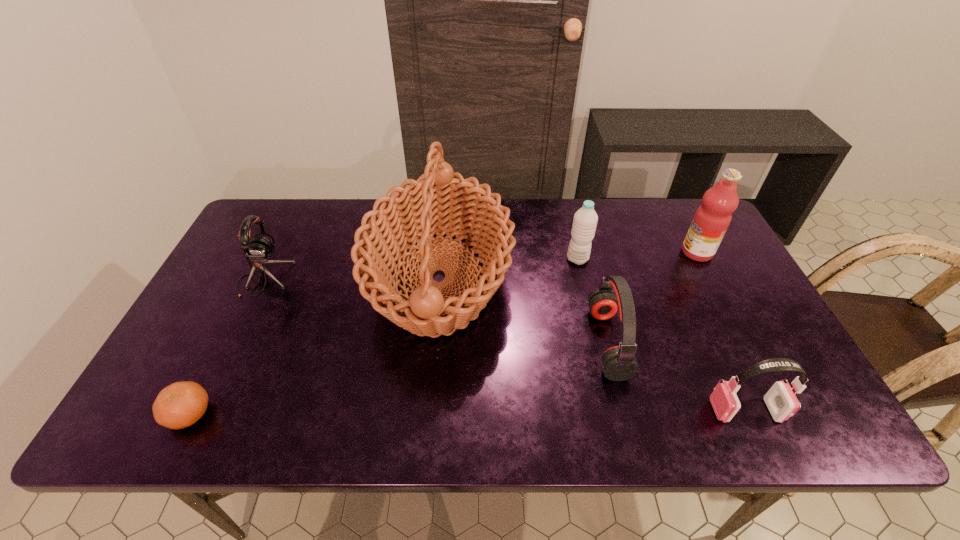
Where is `free space located on the label of the sixth shortest object`? The width and height of the screenshot is (960, 540). free space located on the label of the sixth shortest object is located at coordinates (599, 252).

Identify the location of vacant space situated on the label of the sixth shortest object. (622, 252).

Find the location of a particular element. The width and height of the screenshot is (960, 540). vacant space located 0.230m on the right of the water bottle is located at coordinates (666, 259).

Locate an element on the screen. The width and height of the screenshot is (960, 540). vacant space located 0.220m on the back of the leftmost earphone is located at coordinates (295, 216).

Find the location of a particular element. free location located 0.230m on the ear cups of the second earphone from left to right is located at coordinates (499, 342).

Locate an element on the screen. The height and width of the screenshot is (540, 960). free location located on the ear cups of the second earphone from left to right is located at coordinates (544, 342).

This screenshot has width=960, height=540. What are the coordinates of `vacant point located 0.260m on the ear cups of the second earphone from left to right` in the screenshot? It's located at (488, 342).

The image size is (960, 540). Identify the location of free space located 0.360m on the outer surface of the nearest earphone. (548, 410).

Where is `vacant space located 0.230m on the outer surface of the nearest earphone`? The height and width of the screenshot is (540, 960). vacant space located 0.230m on the outer surface of the nearest earphone is located at coordinates (608, 410).

The image size is (960, 540). I want to click on free space located 0.290m on the outer surface of the nearest earphone, so click(580, 410).